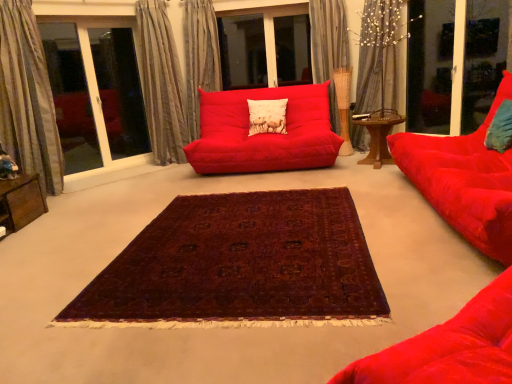
This screenshot has height=384, width=512. What are the coordinates of `free space between wooden table at center, which is counted as the first table, starting from the back, and deep burgundy woven rug at center` in the screenshot? It's located at (358, 189).